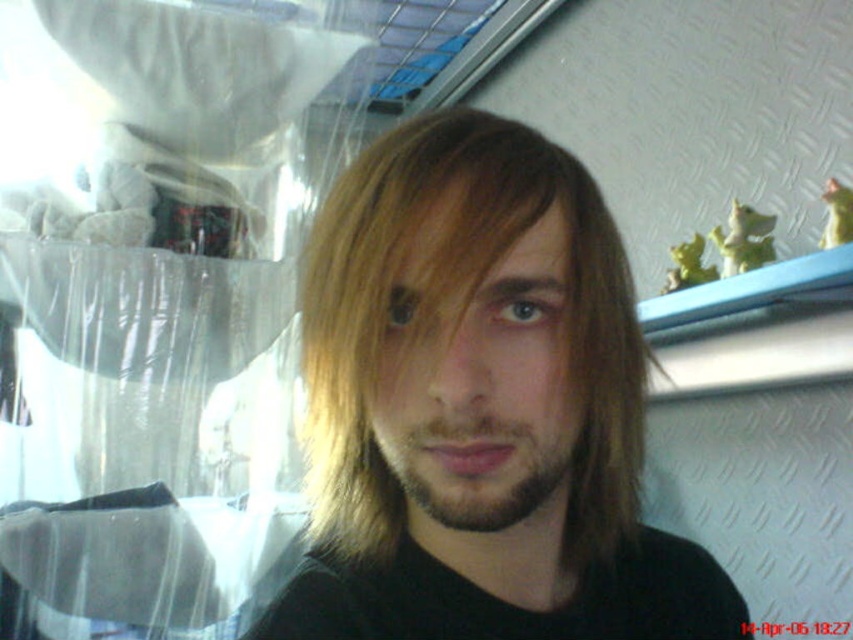
You are a photographer adjusting lighting for a portrait. You notice the blondehair at center and dark brown stubble at center. Which of these two features might require more careful exposure adjustment due to its size and visibility?

The blondehair at center has a larger size compared to dark brown stubble at center, so it might require more careful exposure adjustment due to its prominence and visibility.

You are a photographer adjusting the focus on your camera. You want to ensure both the blondehair at center and dark brown stubble at center are in focus. Given that your camera has a depth of field that can cover 1.8 inches, will both subjects be in focus?

The distance between the blondehair at center and dark brown stubble at center is 1.72 inches, which is within the camera depth of field of 1.8 inches. Therefore, both subjects will be in focus.

From the picture: You are taking a photo of the scene and want to focus on both the person and the shelf with figurines. Which point, point 1 at coordinates (596, 515) or point 2 at coordinates (503, 492), should you use as the focus point to ensure both the person and the shelf are in focus?

Point 1 at coordinates (596, 515) is further to the camera than point 2 at coordinates (503, 492). To ensure both the person and the shelf are in focus, you should choose the point that is closer to the camera, which is point 2 at coordinates (503, 492). This will allow the depth of field to cover both the foreground and background elements more effectively.